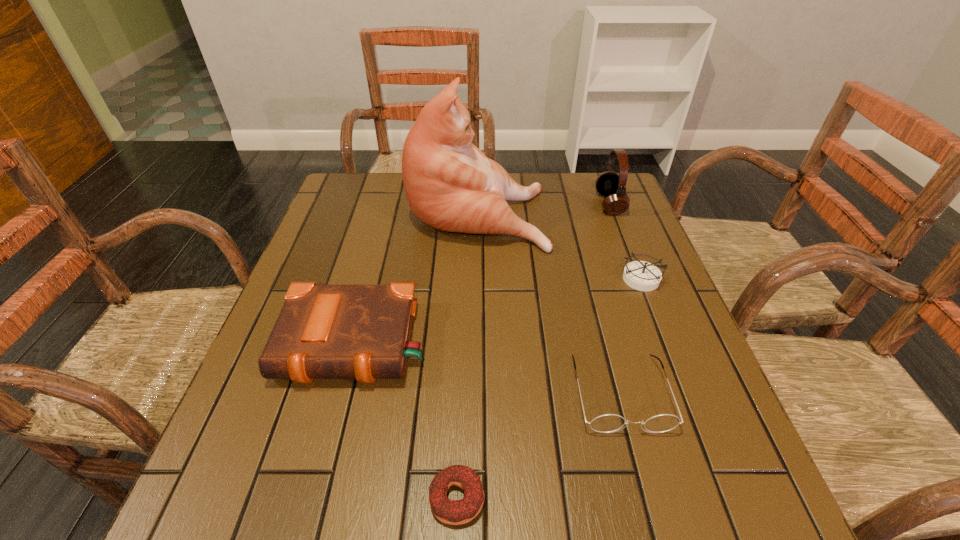
Image resolution: width=960 pixels, height=540 pixels. What are the coordinates of `the third closest object relative to the tallest object` in the screenshot? It's located at (362, 332).

The width and height of the screenshot is (960, 540). I want to click on vacant area in the image that satisfies the following two spatial constraints: 1. on the spine side of the third tallest object; 2. on the left side of the doughnut, so click(315, 498).

This screenshot has height=540, width=960. In order to click on free space in the image that satisfies the following two spatial constraints: 1. on the ear pads of the headset; 2. on the front-facing side of the spectacles in this screenshot , I will do `click(682, 393)`.

Where is `free point that satisfies the following two spatial constraints: 1. on the face of the tallest object; 2. on the right side of the fourth nearest object`? Image resolution: width=960 pixels, height=540 pixels. free point that satisfies the following two spatial constraints: 1. on the face of the tallest object; 2. on the right side of the fourth nearest object is located at coordinates (477, 279).

This screenshot has width=960, height=540. I want to click on vacant space that satisfies the following two spatial constraints: 1. on the spine side of the nearest object; 2. on the right side of the Bible, so click(315, 498).